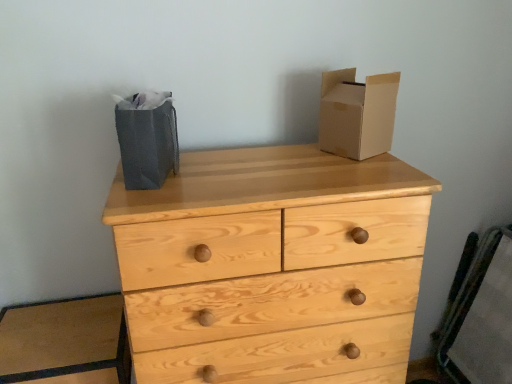
Question: Is cardboard box at upper right wider or thinner than gray paper bag at left?

Choices:
 (A) thin
 (B) wide

Answer: (A)

Question: Considering the positions of point (343, 130) and point (147, 92), is point (343, 130) closer or farther from the camera than point (147, 92)?

Choices:
 (A) farther
 (B) closer

Answer: (B)

Question: Which object is positioned closest to the natural wood chest of drawers at center?

Choices:
 (A) wooden chair at right
 (B) cardboard box at upper right
 (C) gray paper bag at left

Answer: (B)

Question: Which object is the closest to the natural wood chest of drawers at center?

Choices:
 (A) cardboard box at upper right
 (B) wooden chair at right
 (C) gray paper bag at left

Answer: (A)